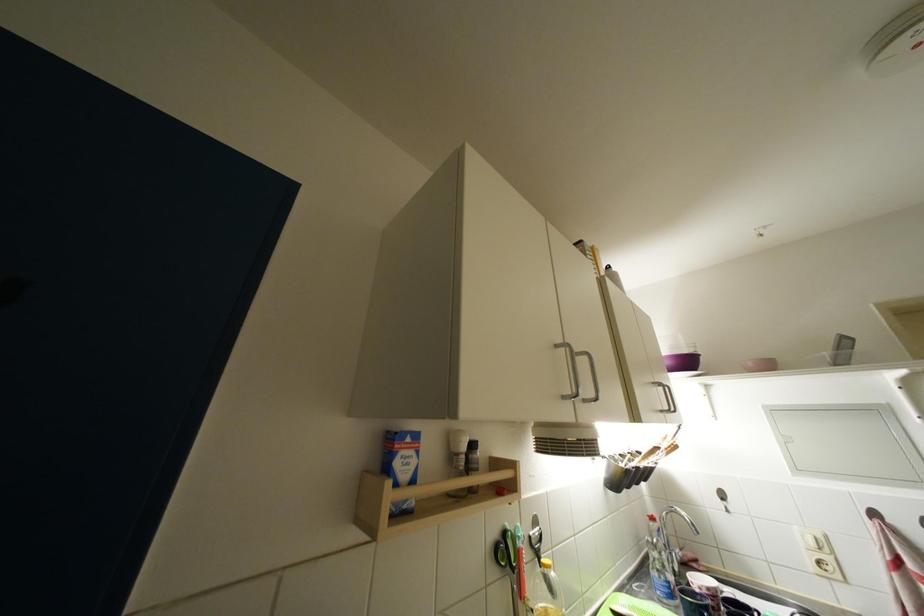
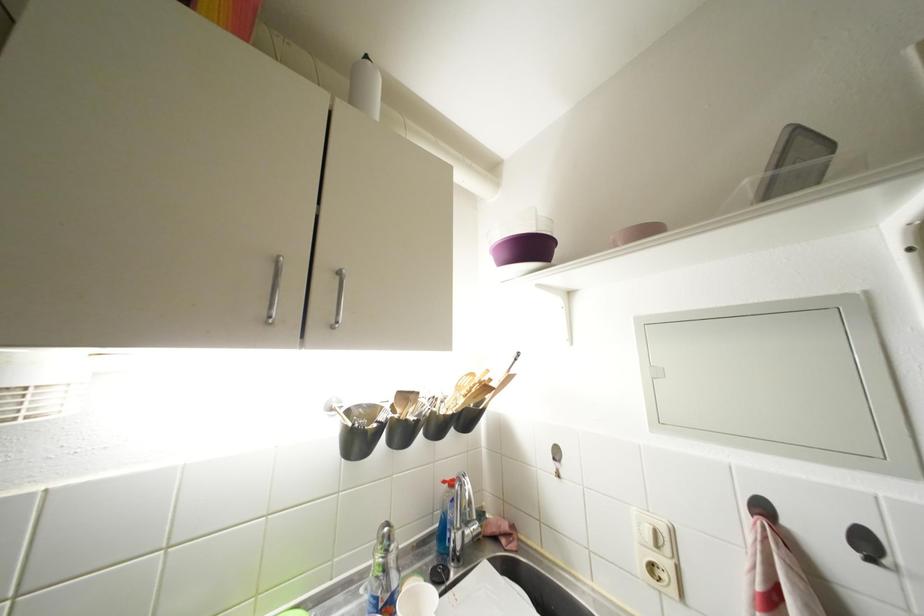
Locate, in the second image, the point that corresponds to point (881, 519) in the first image.

(770, 513)